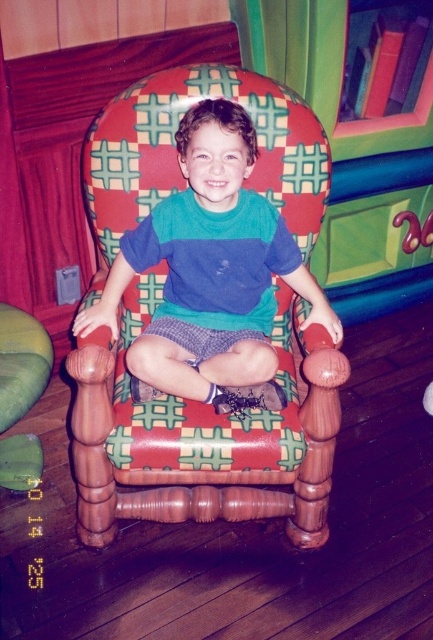
Question: Which object is farther from the camera taking this photo?

Choices:
 (A) matte green shirt at center
 (B) green fabric rocking chair at lower left

Answer: (A)

Question: Is matte green shirt at center closer to camera compared to green fabric rocking chair at lower left?

Choices:
 (A) no
 (B) yes

Answer: (A)

Question: Among these objects, which one is nearest to the camera?

Choices:
 (A) green fabric rocking chair at lower left
 (B) matte green shirt at center

Answer: (A)

Question: Can you confirm if matte green shirt at center is positioned to the left of green fabric rocking chair at lower left?

Choices:
 (A) yes
 (B) no

Answer: (B)

Question: Can you confirm if matte green shirt at center is smaller than green fabric rocking chair at lower left?

Choices:
 (A) yes
 (B) no

Answer: (B)

Question: Which point is farther to the camera?

Choices:
 (A) green fabric rocking chair at lower left
 (B) matte green shirt at center

Answer: (B)